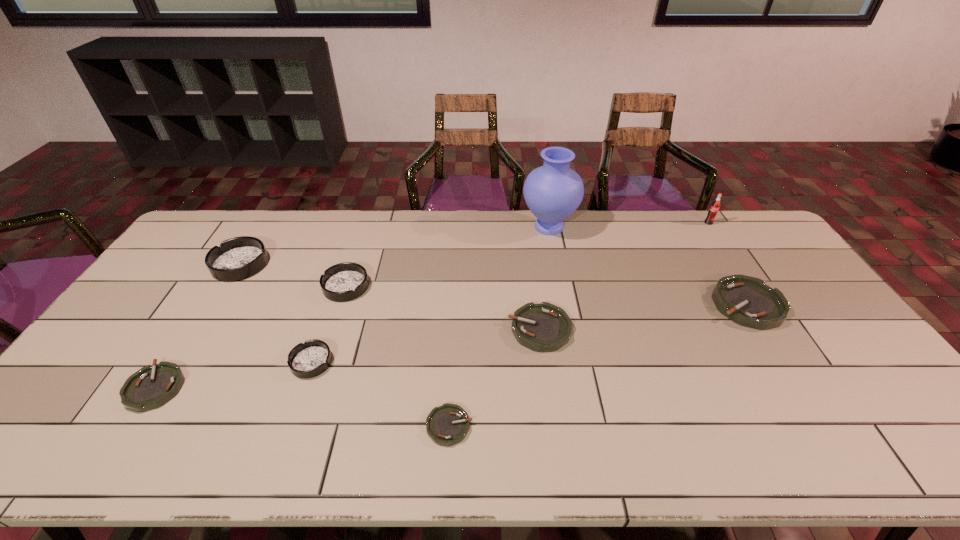
Where is `the nearest dark ashtray`? This screenshot has height=540, width=960. the nearest dark ashtray is located at coordinates (306, 360).

The image size is (960, 540). I want to click on the second shortest ashtray, so click(151, 387).

Where is `the leftmost green ashtray`? the leftmost green ashtray is located at coordinates (151, 387).

Where is `the smallest green ashtray`? The image size is (960, 540). the smallest green ashtray is located at coordinates (446, 425).

Image resolution: width=960 pixels, height=540 pixels. What are the coordinates of `the shortest object` in the screenshot? It's located at (446, 425).

Locate an element on the screen. Image resolution: width=960 pixels, height=540 pixels. vacant point located on the left of the vase is located at coordinates (502, 227).

This screenshot has width=960, height=540. I want to click on vacant point located 0.240m on the label of the soda bottle, so click(x=738, y=268).

In order to click on free spot located 0.150m on the back of the tallest ashtray in this screenshot , I will do `click(266, 223)`.

This screenshot has width=960, height=540. Identify the location of vacant area situated on the front of the second smallest dark ashtray. (307, 405).

The image size is (960, 540). I want to click on blank area located on the front of the rightmost ashtray, so click(778, 353).